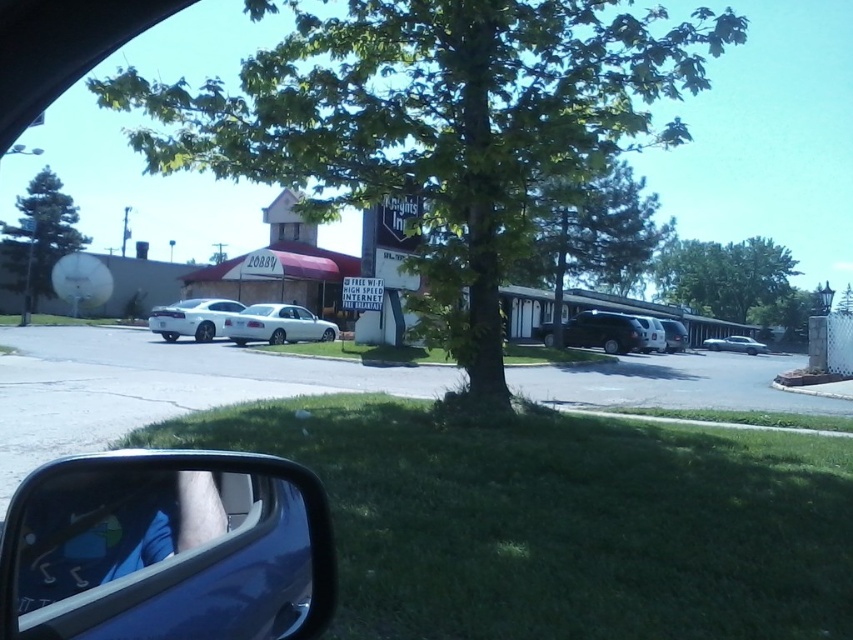
Which of these two, white matte sedan at center or satin black suv at center, stands shorter?

With less height is satin black suv at center.

What do you see at coordinates (276, 324) in the screenshot? I see `white matte sedan at center` at bounding box center [276, 324].

This screenshot has width=853, height=640. In order to click on white matte sedan at center in this screenshot , I will do `click(276, 324)`.

Is satin silver sedan at center smaller than metallic silver van at center?

Incorrect, satin silver sedan at center is not smaller in size than metallic silver van at center.

This screenshot has height=640, width=853. What do you see at coordinates (192, 317) in the screenshot?
I see `satin silver sedan at center` at bounding box center [192, 317].

The width and height of the screenshot is (853, 640). Describe the element at coordinates (192, 317) in the screenshot. I see `satin silver sedan at center` at that location.

Locate an element on the screen. Image resolution: width=853 pixels, height=640 pixels. satin silver sedan at center is located at coordinates (192, 317).

Is satin silver sedan at center thinner than white glossy car window at center?

No, satin silver sedan at center is not thinner than white glossy car window at center.

Is point (210, 310) positioned behind point (285, 312)?

No, it is in front of (285, 312).

What do you see at coordinates (192, 317) in the screenshot? I see `satin silver sedan at center` at bounding box center [192, 317].

You are a GUI agent. You are given a task and a screenshot of the screen. Output one action in this format:
    pyautogui.click(x=<x>, y=<y>)
    Task: Click on the satin silver sedan at center
    The height and width of the screenshot is (640, 853).
    Given the screenshot: What is the action you would take?
    pyautogui.click(x=192, y=317)